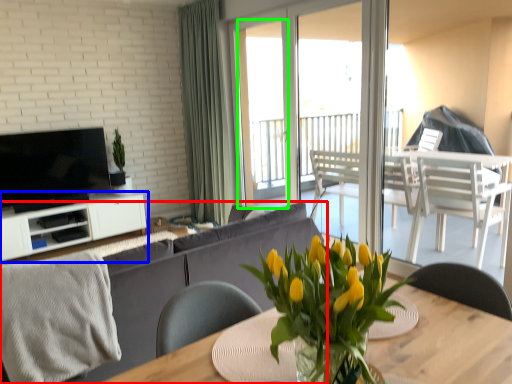
Question: Which object is positioned farthest from studio couch (highlighted by a red box)? Select from cabinetry (highlighted by a blue box) and window screen (highlighted by a green box).

Choices:
 (A) cabinetry
 (B) window screen

Answer: (B)